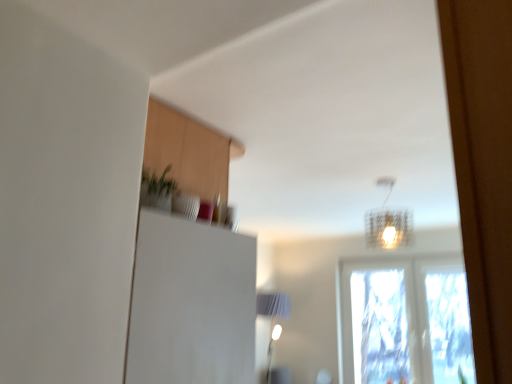
What do you see at coordinates (388, 223) in the screenshot? The width and height of the screenshot is (512, 384). I see `translucent wire mesh lampshade at upper center` at bounding box center [388, 223].

At what (x,y) coordinates should I click in order to perform the action: click on translucent wire mesh lampshade at upper center. Please return your answer as a coordinate pair (x, y). This screenshot has width=512, height=384. Looking at the image, I should click on (388, 223).

What do you see at coordinates (403, 321) in the screenshot?
I see `transparent glass window at center` at bounding box center [403, 321].

Find the location of a particular element. This screenshot has height=384, width=512. transparent glass window at center is located at coordinates (403, 321).

Find the location of a particular element. translucent wire mesh lampshade at upper center is located at coordinates (388, 223).

Does transparent glass window at center appear on the right side of translucent wire mesh lampshade at upper center?

Indeed, transparent glass window at center is positioned on the right side of translucent wire mesh lampshade at upper center.

Which object is closer to the camera taking this photo, transparent glass window at center or translucent wire mesh lampshade at upper center?

translucent wire mesh lampshade at upper center is more forward.

Considering the positions of point (469, 334) and point (367, 214), is point (469, 334) closer or farther from the camera than point (367, 214)?

Point (469, 334) is closer to the camera than point (367, 214).

From the image's perspective, would you say transparent glass window at center is shown under translucent wire mesh lampshade at upper center?

Correct, transparent glass window at center appears lower than translucent wire mesh lampshade at upper center in the image.

From a real-world perspective, is transparent glass window at center over translucent wire mesh lampshade at upper center?

No.

In terms of width, does transparent glass window at center look wider or thinner when compared to translucent wire mesh lampshade at upper center?

transparent glass window at center is thinner than translucent wire mesh lampshade at upper center.

Is transparent glass window at center taller than translucent wire mesh lampshade at upper center?

Correct, transparent glass window at center is much taller as translucent wire mesh lampshade at upper center.

Between transparent glass window at center and translucent wire mesh lampshade at upper center, which one has larger size?

With larger size is transparent glass window at center.

Would you say transparent glass window at center is outside translucent wire mesh lampshade at upper center?

transparent glass window at center is positioned outside translucent wire mesh lampshade at upper center.

Is transparent glass window at center directly adjacent to translucent wire mesh lampshade at upper center?

transparent glass window at center and translucent wire mesh lampshade at upper center are not in contact.

Consider the image. Is transparent glass window at center turned away from translucent wire mesh lampshade at upper center?

No, transparent glass window at center is not facing the opposite direction of translucent wire mesh lampshade at upper center.

I want to click on window on the right of the translucent wire mesh lampshade at upper center, so click(403, 321).

Which object is positioned more to the left, translucent wire mesh lampshade at upper center or transparent glass window at center?

Positioned to the left is translucent wire mesh lampshade at upper center.

Is translucent wire mesh lampshade at upper center closer to the viewer compared to transparent glass window at center?

Yes, translucent wire mesh lampshade at upper center is closer to the camera.

Is point (389, 232) closer to camera compared to point (405, 366)?

Yes, point (389, 232) is in front of point (405, 366).

From the image's perspective, between translucent wire mesh lampshade at upper center and transparent glass window at center, which one is located above?

translucent wire mesh lampshade at upper center is shown above in the image.

From a real-world perspective, is translucent wire mesh lampshade at upper center above or below transparent glass window at center?

From a real-world perspective, translucent wire mesh lampshade at upper center is physically above transparent glass window at center.

Which of these two, translucent wire mesh lampshade at upper center or transparent glass window at center, is wider?

translucent wire mesh lampshade at upper center is wider.

Considering the relative sizes of translucent wire mesh lampshade at upper center and transparent glass window at center in the image provided, is translucent wire mesh lampshade at upper center taller than transparent glass window at center?

No, translucent wire mesh lampshade at upper center is not taller than transparent glass window at center.

Is translucent wire mesh lampshade at upper center smaller than transparent glass window at center?

Yes, translucent wire mesh lampshade at upper center is smaller than transparent glass window at center.

Consider the image. Is transparent glass window at center surrounded by translucent wire mesh lampshade at upper center?

Definitely not — transparent glass window at center is not inside translucent wire mesh lampshade at upper center.

Are translucent wire mesh lampshade at upper center and transparent glass window at center making contact?

No, translucent wire mesh lampshade at upper center is not touching transparent glass window at center.

Could you tell me if translucent wire mesh lampshade at upper center is turned towards transparent glass window at center?

No, translucent wire mesh lampshade at upper center is not facing towards transparent glass window at center.

What's the angular difference between translucent wire mesh lampshade at upper center and transparent glass window at center's facing directions?

2.39 degrees.

I want to click on window on the right of translucent wire mesh lampshade at upper center, so click(403, 321).

Locate an element on the screen. This screenshot has width=512, height=384. lamp in front of the transparent glass window at center is located at coordinates click(x=388, y=223).

Find the location of a particular element. window below the translucent wire mesh lampshade at upper center (from the image's perspective) is located at coordinates (403, 321).